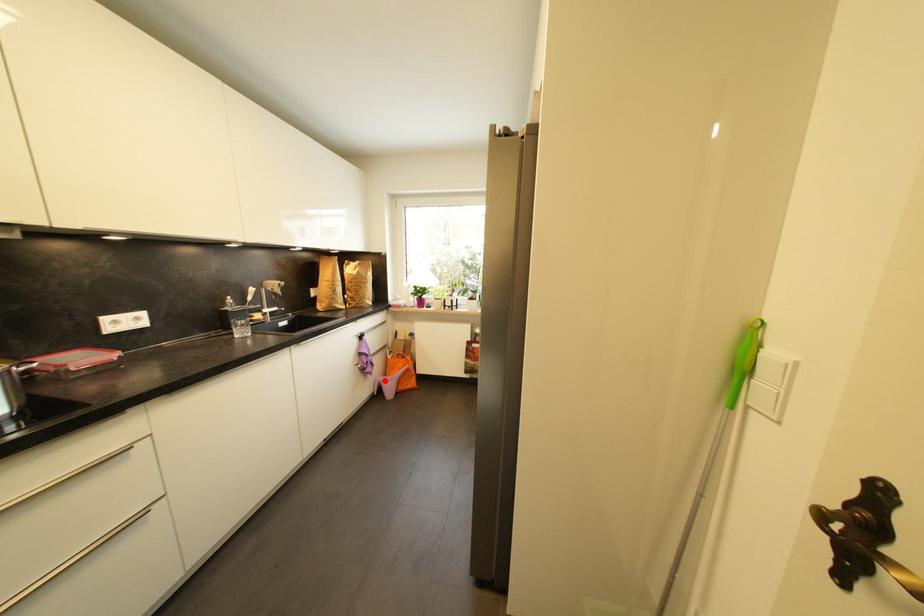
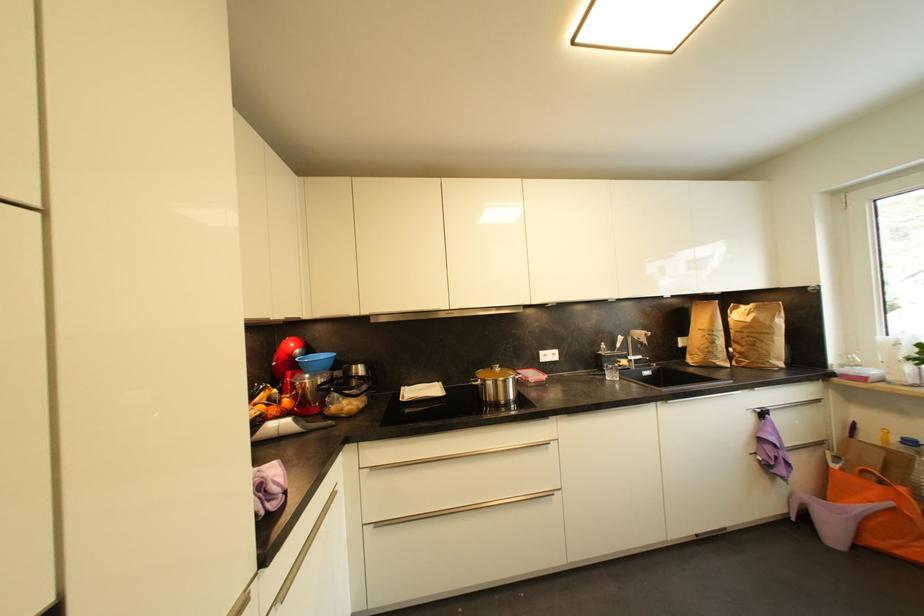
Question: I am providing you with two images of the same scene from different viewpoints. A red point is shown in image1. For the corresponding object point in image2, is it positioned nearer or farther from the camera?

Choices:
 (A) Nearer
 (B) Farther

Answer: (A)